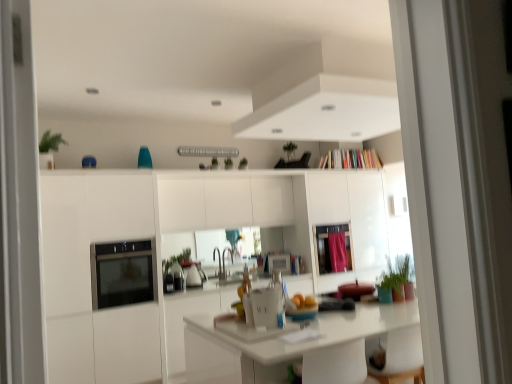
Question: Is pink fabric screen door at center further to camera compared to pink fabric curtain at upper center?

Choices:
 (A) no
 (B) yes

Answer: (A)

Question: Does pink fabric screen door at center have a larger size compared to pink fabric curtain at upper center?

Choices:
 (A) yes
 (B) no

Answer: (A)

Question: Is pink fabric screen door at center oriented towards pink fabric curtain at upper center?

Choices:
 (A) no
 (B) yes

Answer: (B)

Question: Is pink fabric screen door at center not within pink fabric curtain at upper center?

Choices:
 (A) yes
 (B) no

Answer: (A)

Question: Are pink fabric screen door at center and pink fabric curtain at upper center located far from each other?

Choices:
 (A) yes
 (B) no

Answer: (B)

Question: Is pink fabric screen door at center at the right side of pink fabric curtain at upper center?

Choices:
 (A) no
 (B) yes

Answer: (A)

Question: Would you say white glossy microwave at center is a long distance from pink fabric screen door at center?

Choices:
 (A) yes
 (B) no

Answer: (B)

Question: Is white glossy microwave at center thinner than pink fabric screen door at center?

Choices:
 (A) no
 (B) yes

Answer: (B)

Question: Is white glossy microwave at center wider than pink fabric screen door at center?

Choices:
 (A) no
 (B) yes

Answer: (A)

Question: Is white glossy microwave at center not inside pink fabric screen door at center?

Choices:
 (A) no
 (B) yes

Answer: (B)

Question: Is white glossy microwave at center shorter than pink fabric screen door at center?

Choices:
 (A) no
 (B) yes

Answer: (B)

Question: Is white glossy microwave at center positioned with its back to pink fabric screen door at center?

Choices:
 (A) no
 (B) yes

Answer: (A)

Question: Would you say pink fabric curtain at upper center is outside green matte plant at upper center, placed as the second plant when sorted from top to bottom?

Choices:
 (A) no
 (B) yes

Answer: (B)